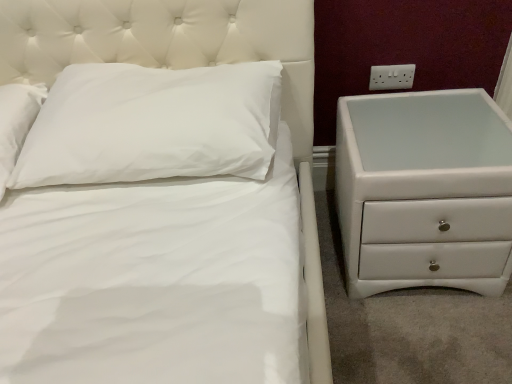
Question: Is white plastic electrical outlet at upper right taller or shorter than white soft pillow at upper left?

Choices:
 (A) short
 (B) tall

Answer: (A)

Question: From the image's perspective, is white plastic electrical outlet at upper right positioned above or below white soft pillow at upper left?

Choices:
 (A) below
 (B) above

Answer: (B)

Question: Which is farther from the white glossy chest of drawers at right?

Choices:
 (A) white plastic electrical outlet at upper right
 (B) white soft pillow at upper left

Answer: (B)

Question: Which object is the closest to the white soft pillow at upper left?

Choices:
 (A) white plastic electrical outlet at upper right
 (B) white glossy chest of drawers at right

Answer: (B)